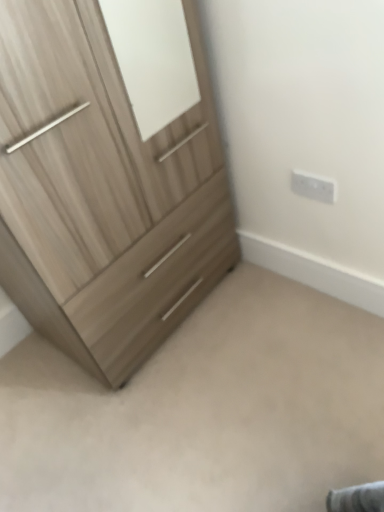
Question: Is light wood/texture chest of drawers at left not within white plastic electric outlet at upper right?

Choices:
 (A) yes
 (B) no

Answer: (A)

Question: Is light wood/texture chest of drawers at left further to camera compared to white plastic electric outlet at upper right?

Choices:
 (A) yes
 (B) no

Answer: (B)

Question: Is light wood/texture chest of drawers at left next to white plastic electric outlet at upper right?

Choices:
 (A) no
 (B) yes

Answer: (A)

Question: Considering the relative positions of light wood/texture chest of drawers at left and white plastic electric outlet at upper right in the image provided, is light wood/texture chest of drawers at left to the left of white plastic electric outlet at upper right from the viewer's perspective?

Choices:
 (A) no
 (B) yes

Answer: (B)

Question: Considering the relative sizes of light wood/texture chest of drawers at left and white plastic electric outlet at upper right in the image provided, is light wood/texture chest of drawers at left shorter than white plastic electric outlet at upper right?

Choices:
 (A) no
 (B) yes

Answer: (A)

Question: Is light wood/texture chest of drawers at left surrounding white plastic electric outlet at upper right?

Choices:
 (A) no
 (B) yes

Answer: (A)

Question: From a real-world perspective, is light wood dresser at lower left physically below white plastic electric outlet at upper right?

Choices:
 (A) yes
 (B) no

Answer: (A)

Question: Does light wood dresser at lower left have a smaller size compared to white plastic electric outlet at upper right?

Choices:
 (A) no
 (B) yes

Answer: (A)

Question: From a real-world perspective, is light wood dresser at lower left positioned over white plastic electric outlet at upper right based on gravity?

Choices:
 (A) no
 (B) yes

Answer: (A)

Question: Does light wood dresser at lower left have a greater width compared to white plastic electric outlet at upper right?

Choices:
 (A) yes
 (B) no

Answer: (A)

Question: Is the position of light wood dresser at lower left more distant than that of white plastic electric outlet at upper right?

Choices:
 (A) no
 (B) yes

Answer: (A)

Question: Is light wood dresser at lower left bigger than white plastic electric outlet at upper right?

Choices:
 (A) yes
 (B) no

Answer: (A)

Question: Is white plastic electric outlet at upper right wider than light wood/texture chest of drawers at left?

Choices:
 (A) yes
 (B) no

Answer: (B)